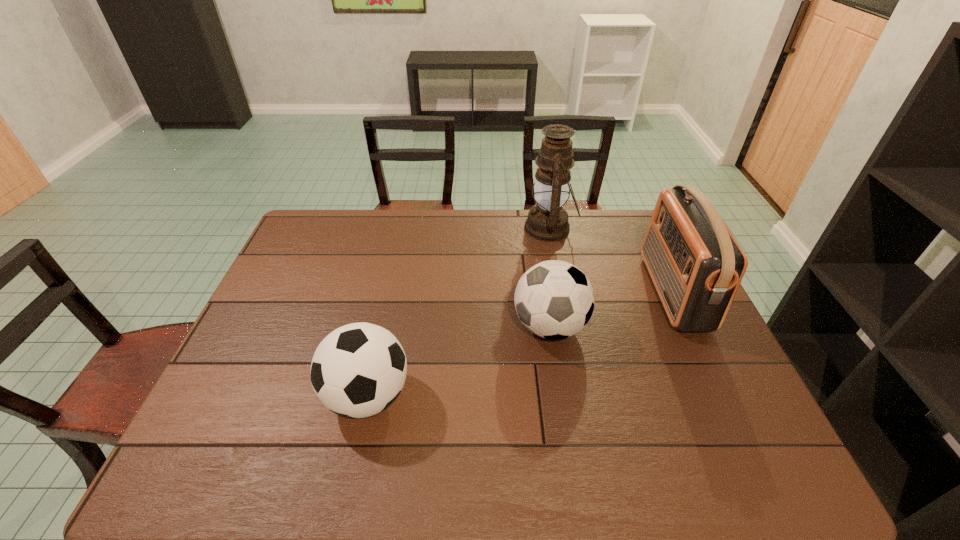
Where is `vacant space at the right edge of the desktop`? vacant space at the right edge of the desktop is located at coordinates (700, 363).

I want to click on free space between the leftmost object and the farther soccer ball, so click(459, 361).

What are the coordinates of `free space between the farthest object and the nearer soccer ball` in the screenshot? It's located at (459, 312).

Image resolution: width=960 pixels, height=540 pixels. Identify the location of unoccupied position between the farther soccer ball and the left soccer ball. (459, 361).

Image resolution: width=960 pixels, height=540 pixels. I want to click on free point between the nearest object and the tallest object, so click(459, 312).

At what (x,y) coordinates should I click in order to perform the action: click on vacant point located between the nearer soccer ball and the radio receiver. Please return your answer as a coordinate pair (x, y). The height and width of the screenshot is (540, 960). Looking at the image, I should click on (520, 343).

Where is `empty space that is in between the second tallest object and the nearest object`? empty space that is in between the second tallest object and the nearest object is located at coordinates (520, 343).

Locate an element on the screen. unoccupied position between the oil lamp and the nearest object is located at coordinates (459, 312).

Where is `free space between the tallest object and the rightmost object`? The image size is (960, 540). free space between the tallest object and the rightmost object is located at coordinates (612, 260).

You are a GUI agent. You are given a task and a screenshot of the screen. Output one action in this format:
    pyautogui.click(x=<x>, y=<y>)
    Task: Click on the free point between the nearer soccer ball and the oil lamp
    This screenshot has height=540, width=960.
    Given the screenshot: What is the action you would take?
    pyautogui.click(x=459, y=312)